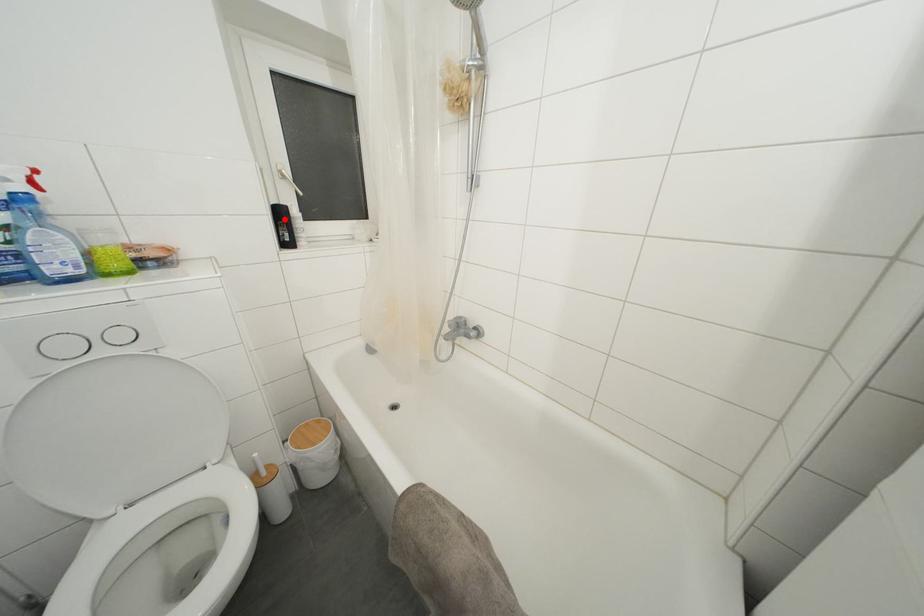
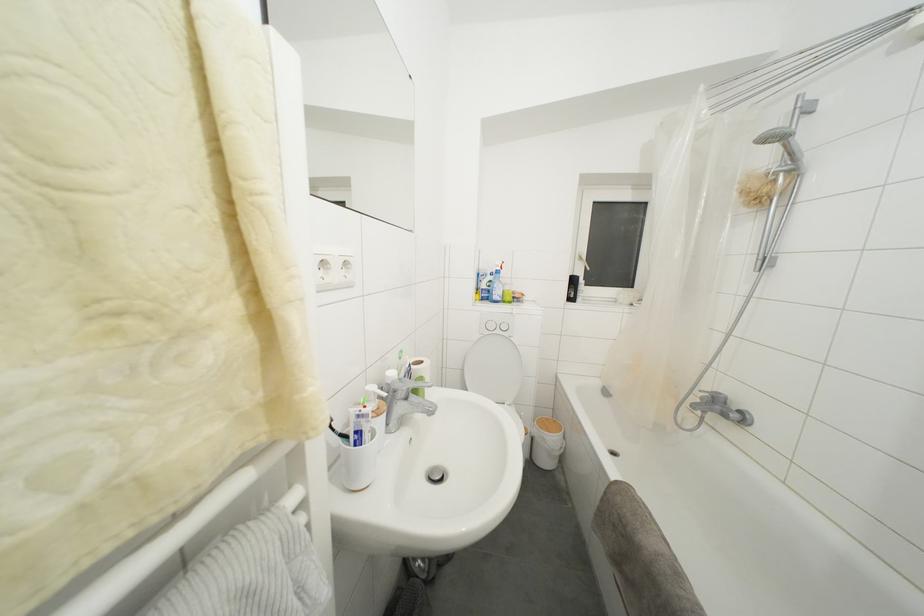
Find the pixel in the second image that matches the highlighted location in the first image.

(578, 286)